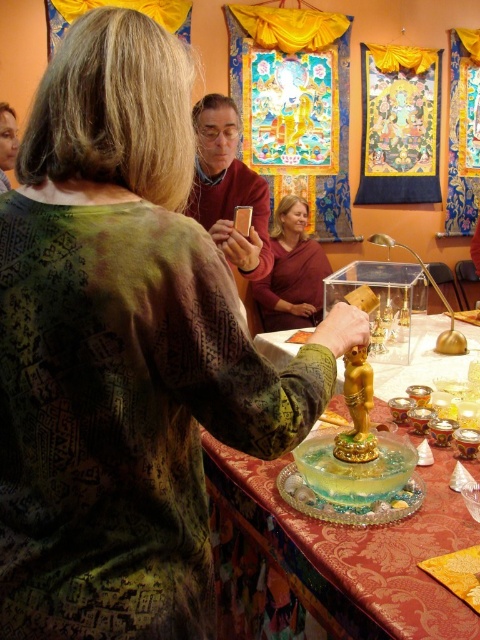
Question: Can you confirm if translucent glass statue at center is wider than translucent gelatinous cake at center?

Choices:
 (A) yes
 (B) no

Answer: (A)

Question: Does translucent glass statue at center come behind translucent gelatinous cake at center?

Choices:
 (A) no
 (B) yes

Answer: (A)

Question: Considering the real-world distances, which object is farthest from the translucent glass statue at center?

Choices:
 (A) matte brown statue at center
 (B) translucent gelatinous cake at center

Answer: (A)

Question: Among these objects, which one is farthest from the camera?

Choices:
 (A) matte brown statue at center
 (B) translucent glass statue at center

Answer: (A)

Question: Which is farther from the translucent gelatinous cake at center?

Choices:
 (A) translucent glass statue at center
 (B) matte brown statue at center

Answer: (B)

Question: Can you confirm if matte brown statue at center is thinner than translucent gelatinous cake at center?

Choices:
 (A) no
 (B) yes

Answer: (A)